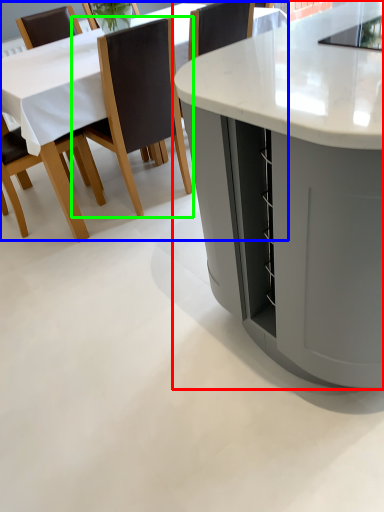
Question: Which object is positioned closest to table (highlighted by a red box)? Select from table (highlighted by a blue box) and chair (highlighted by a green box).

Choices:
 (A) table
 (B) chair

Answer: (B)